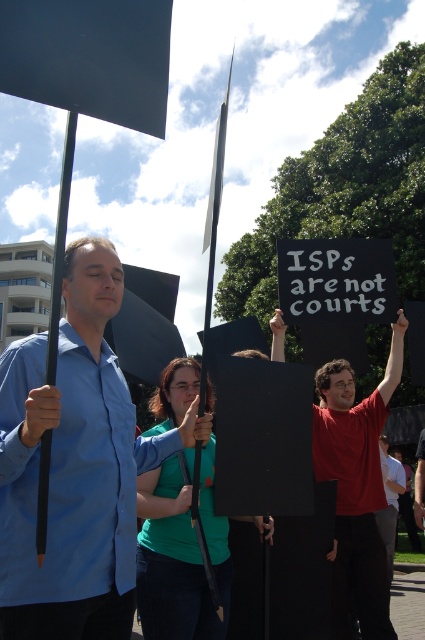
Is matte black sign at center taller than matte red shirt at center?

Correct, matte black sign at center is much taller as matte red shirt at center.

Measure the distance between point [359,579] and camera.

A distance of 5.86 meters exists between point [359,579] and camera.

The width and height of the screenshot is (425, 640). I want to click on matte black sign at center, so click(x=357, y=486).

Can you confirm if blue fabric shirt at center is taller than matte black sign at center?

In fact, blue fabric shirt at center may be shorter than matte black sign at center.

Who is positioned more to the right, blue fabric shirt at center or matte black sign at center?

matte black sign at center

Between point (51, 493) and point (363, 552), which one is positioned in front?

Point (51, 493)

Locate an element on the screen. blue fabric shirt at center is located at coordinates (76, 467).

From the picture: Does blue fabric shirt at center appear on the right side of matte red shirt at center?

Incorrect, blue fabric shirt at center is not on the right side of matte red shirt at center.

Which is behind, point (181, 428) or point (393, 541)?

Point (393, 541)

Where is `blue fabric shirt at center`? This screenshot has width=425, height=640. blue fabric shirt at center is located at coordinates (76, 467).